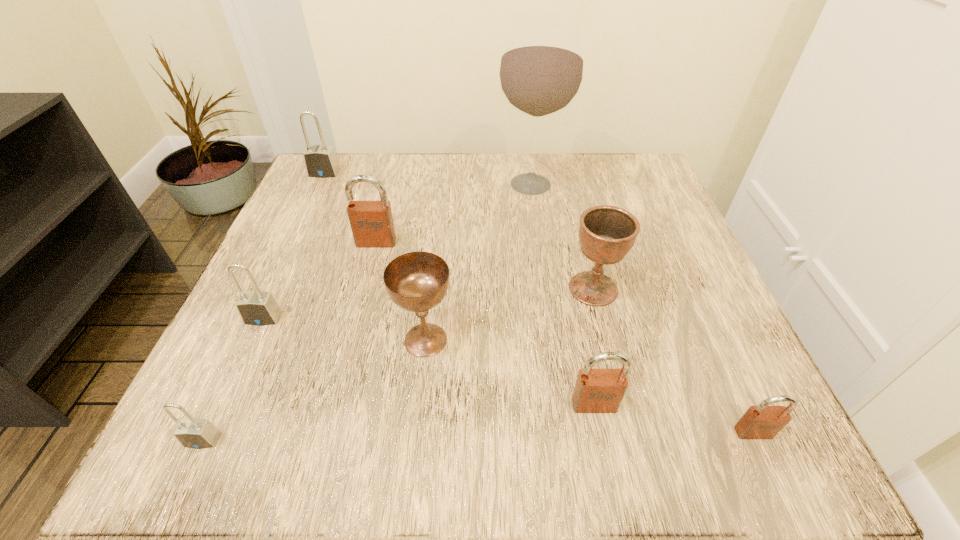
Find the location of a particular element. This screenshot has height=540, width=960. vacant space located 0.100m on the back of the sixth nearest object is located at coordinates (580, 235).

This screenshot has height=540, width=960. I want to click on free region located 0.250m on the back of the fifth object from right to left, so click(438, 223).

Identify the location of vacant space situated 0.170m on the shackle of the third farthest padlock. This screenshot has height=540, width=960. (215, 426).

The height and width of the screenshot is (540, 960). Find the location of `alcohol present at the far edge`. alcohol present at the far edge is located at coordinates (541, 69).

Locate an element on the screen. This screenshot has height=540, width=960. padlock present at the far edge is located at coordinates (320, 161).

Identify the location of chalice that is positioned at the right edge. (607, 233).

The height and width of the screenshot is (540, 960). Identify the location of padlock present at the right edge. (763, 421).

This screenshot has width=960, height=540. I want to click on object at the far left corner, so click(320, 161).

This screenshot has width=960, height=540. I want to click on object that is positioned at the near left corner, so click(x=194, y=433).

Identify the location of object that is at the near right corner. (763, 421).